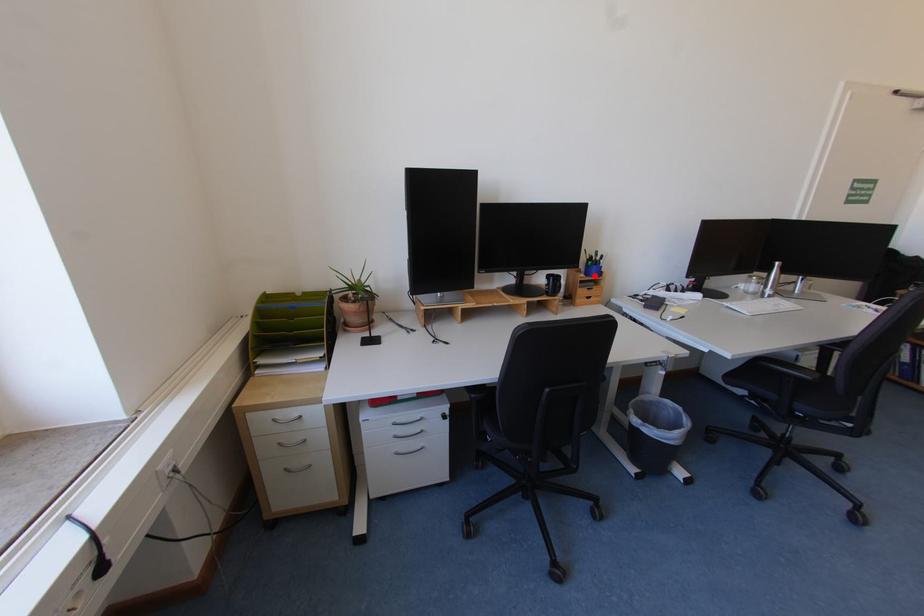
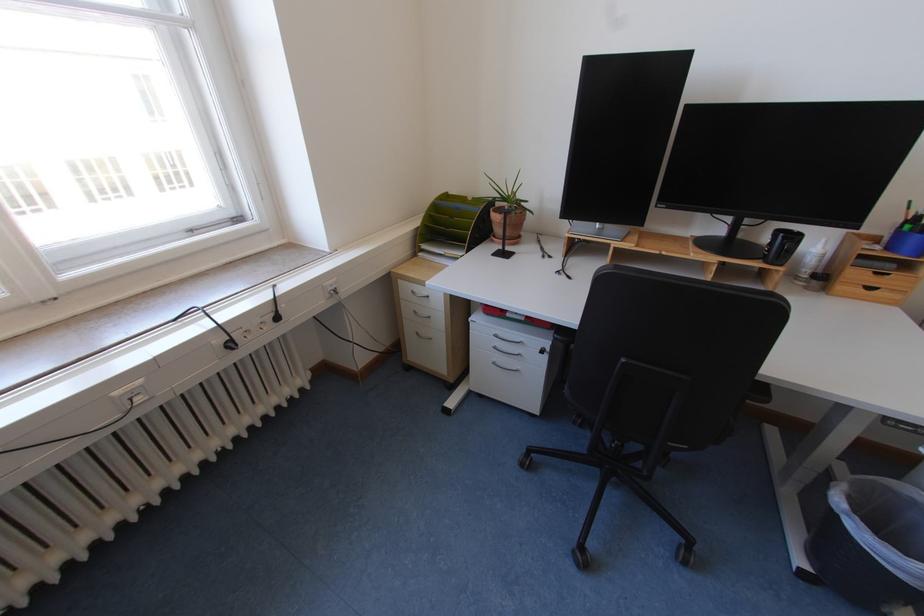
Question: A red point is marked in image1. In image2, is the corresponding 3D point closer to the camera or farther? Reply with the corresponding letter.

Choices:
 (A) The corresponding 3D point is closer.
 (B) The corresponding 3D point is farther.

Answer: (B)